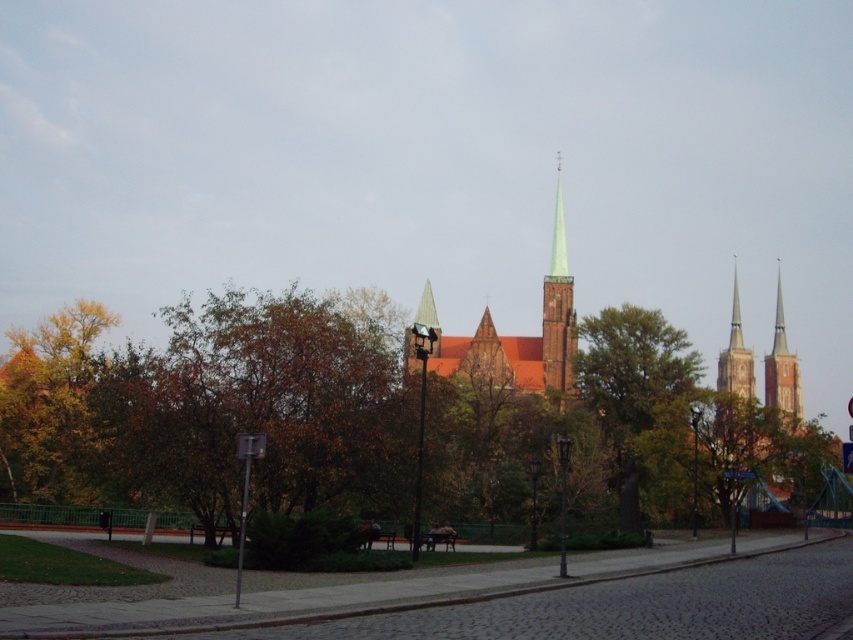
Question: Can you confirm if green leafy tree at center is bigger than green glass spire at center?

Choices:
 (A) yes
 (B) no

Answer: (A)

Question: Which of the following is the farthest from the observer?

Choices:
 (A) green glass spire at center
 (B) green leafy tree at center

Answer: (A)

Question: Is green leafy tree at center smaller than green glass spire at center?

Choices:
 (A) no
 (B) yes

Answer: (A)

Question: Which object appears farthest from the camera in this image?

Choices:
 (A) green glass spire at center
 (B) green leafy tree at center

Answer: (A)

Question: Which object appears closest to the camera in this image?

Choices:
 (A) green glass spire at center
 (B) green leafy tree at center

Answer: (B)

Question: Is green leafy tree at center in front of green glass spire at center?

Choices:
 (A) no
 (B) yes

Answer: (B)